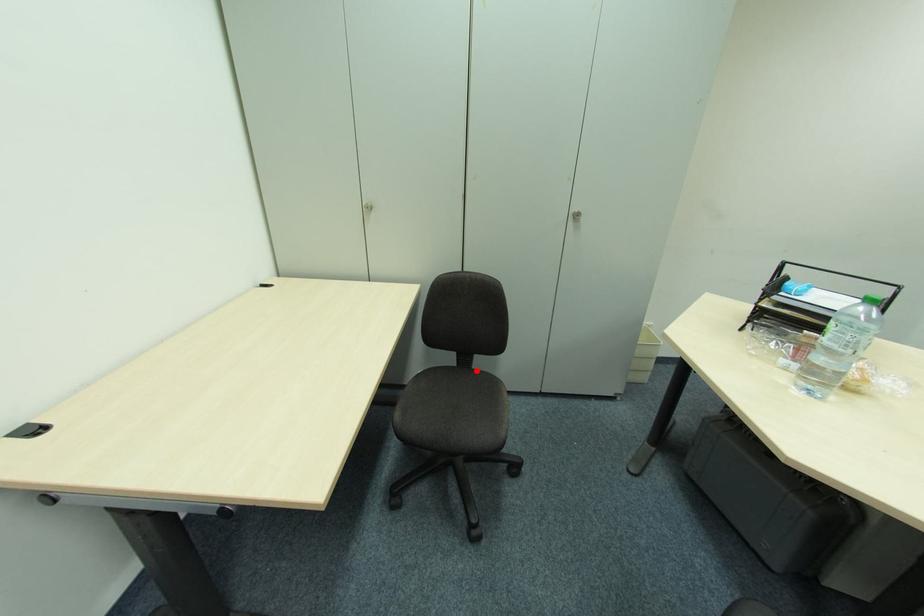
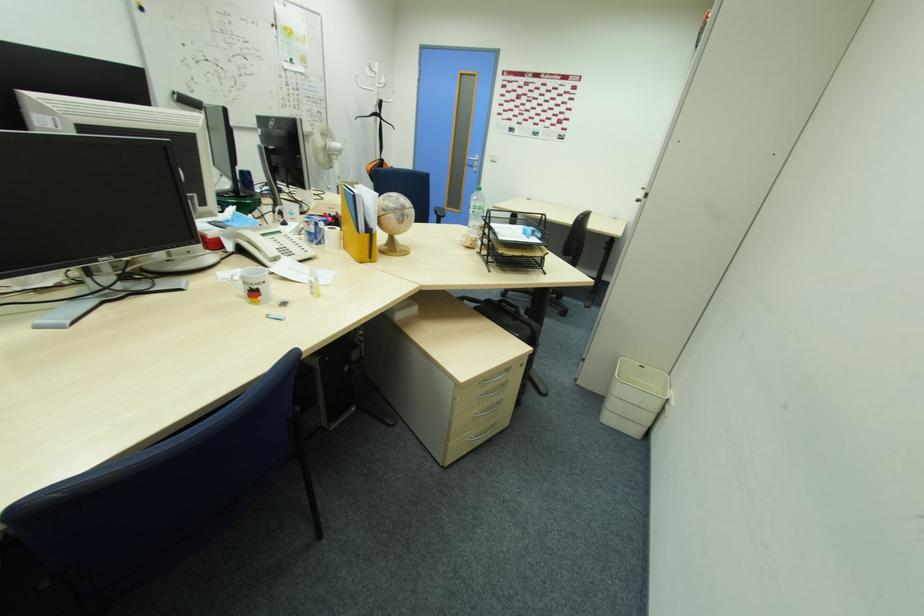
Question: I am providing you with two images of the same scene from different viewpoints. A red point is marked on the first image. At the location where the point appears in image 1, is it still visible in image 2?

Choices:
 (A) Yes
 (B) No

Answer: (B)